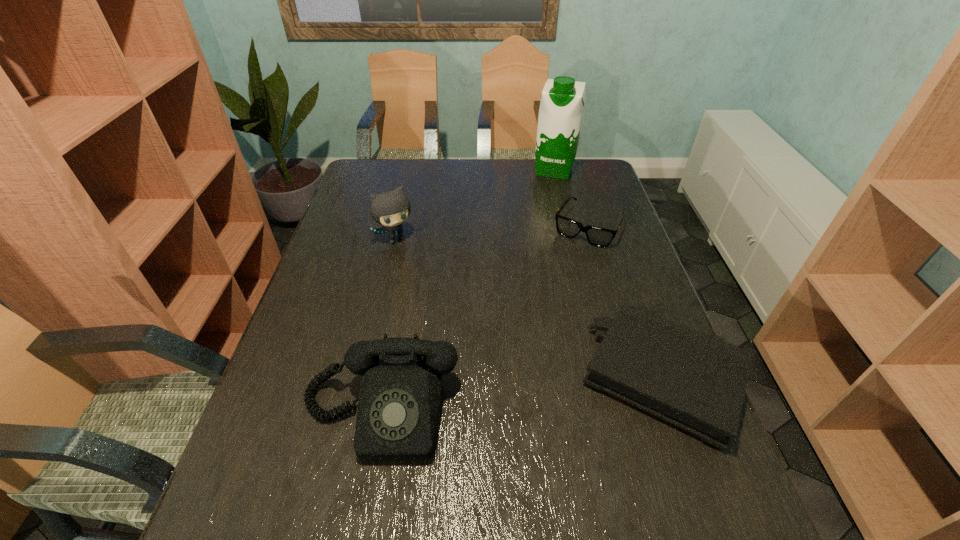
Find the location of a particular element. vacant space at the far left corner of the desktop is located at coordinates (356, 181).

This screenshot has height=540, width=960. I want to click on vacant space at the far right corner of the desktop, so click(583, 176).

Identify the location of free spot between the fourth tallest object and the soya milk. (609, 274).

You are a GUI agent. You are given a task and a screenshot of the screen. Output one action in this format:
    pyautogui.click(x=<x>, y=<y>)
    Task: Click on the vacant area that lies between the telephone and the soya milk
    The height and width of the screenshot is (540, 960).
    Given the screenshot: What is the action you would take?
    pyautogui.click(x=467, y=292)

This screenshot has height=540, width=960. I want to click on free space between the telephone and the soya milk, so click(467, 292).

This screenshot has width=960, height=540. Find the location of `free space between the tallest object and the shortest object`. free space between the tallest object and the shortest object is located at coordinates (571, 199).

Where is `vacant area that lies between the sunglasses and the telephone`? This screenshot has width=960, height=540. vacant area that lies between the sunglasses and the telephone is located at coordinates (484, 320).

Locate an element on the screen. The width and height of the screenshot is (960, 540). free space between the soya milk and the kitten is located at coordinates (476, 205).

Where is `free point between the telephone and the kitten`? free point between the telephone and the kitten is located at coordinates (389, 326).

Find the location of `vacant area that lies between the telephone and the Bible`. vacant area that lies between the telephone and the Bible is located at coordinates (521, 396).